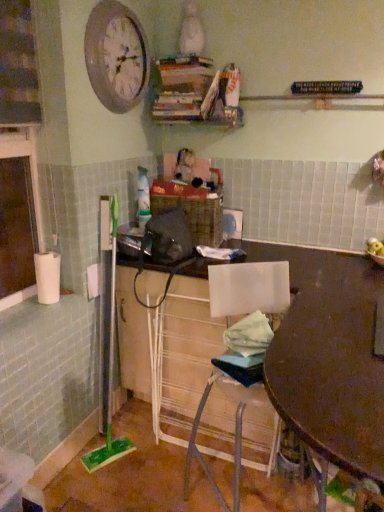
Image resolution: width=384 pixels, height=512 pixels. What do you see at coordinates (321, 267) in the screenshot?
I see `matte brown desk at center` at bounding box center [321, 267].

This screenshot has height=512, width=384. I want to click on wooden clock at upper left, so click(116, 56).

Is there a large distance between wooden clock at upper left and white plastic chair at lower center?

Indeed, wooden clock at upper left is not near white plastic chair at lower center.

Is wooden clock at upper left at the left side of white plastic chair at lower center?

Yes, wooden clock at upper left is to the left of white plastic chair at lower center.

Could you tell me if wooden clock at upper left is facing white plastic chair at lower center?

No, wooden clock at upper left is not oriented towards white plastic chair at lower center.

Looking at the image, does wooden clock at upper left seem bigger or smaller compared to white plastic chair at lower center?

In the image, wooden clock at upper left appears to be smaller than white plastic chair at lower center.

Is white plastic chair at lower center turned away from wooden clock at upper left?

That's not correct — white plastic chair at lower center is not looking away from wooden clock at upper left.

Considering the sizes of white plastic chair at lower center and wooden clock at upper left in the image, is white plastic chair at lower center taller or shorter than wooden clock at upper left?

white plastic chair at lower center is taller than wooden clock at upper left.

Is there a large distance between white plastic chair at lower center and wooden clock at upper left?

Yes, white plastic chair at lower center is far from wooden clock at upper left.

Is white plastic chair at lower center bigger than wooden clock at upper left?

Indeed, white plastic chair at lower center has a larger size compared to wooden clock at upper left.

Can you tell me how much matte brown desk at center and wooden table at center differ in facing direction?

The angle between the facing direction of matte brown desk at center and the facing direction of wooden table at center is 0.000539 degrees.

Considering the sizes of matte brown desk at center and wooden table at center in the image, is matte brown desk at center wider or thinner than wooden table at center?

Clearly, matte brown desk at center has less width compared to wooden table at center.

Measure the distance between matte brown desk at center and wooden table at center.

The distance of matte brown desk at center from wooden table at center is 15.32 inches.

Is matte brown desk at center far away from wooden table at center?

No, matte brown desk at center is not far from wooden table at center.

How much distance is there between matte brown desk at center and white plastic chair at lower center?

They are 33.31 centimeters apart.

Is matte brown desk at center far from white plastic chair at lower center?

No.

From their relative heights in the image, would you say matte brown desk at center is taller or shorter than white plastic chair at lower center?

Considering their sizes, matte brown desk at center has more height than white plastic chair at lower center.

Does matte brown desk at center have a larger size compared to white plastic chair at lower center?

Yes, matte brown desk at center is bigger than white plastic chair at lower center.

Considering the positions of point (350, 456) and point (299, 291), is point (350, 456) closer or farther from the camera than point (299, 291)?

Point (350, 456).

Identify the location of desk that appears above the wooden table at center (from the image's perspective). This screenshot has height=512, width=384. (321, 267).

Could you tell me if wooden table at center is turned towards matte brown desk at center?

No.

From the picture: From a real-world perspective, which is physically below, wooden table at center or matte brown desk at center?

matte brown desk at center is physically lower.

Where is `desk located on the right of wooden clock at upper left`? The width and height of the screenshot is (384, 512). desk located on the right of wooden clock at upper left is located at coordinates (321, 267).

Is matte brown desk at center far away from wooden clock at upper left?

Yes, matte brown desk at center and wooden clock at upper left are quite far apart.

Which object is further away from the camera, matte brown desk at center or wooden clock at upper left?

wooden clock at upper left.

Considering the points (257, 250) and (92, 57), which point is behind, point (257, 250) or point (92, 57)?

The point (257, 250) is farther from the camera.

From a real-world perspective, is wooden clock at upper left under matte brown desk at center?

No.

From the image's perspective, which one is positioned higher, wooden clock at upper left or matte brown desk at center?

wooden clock at upper left, from the image's perspective.

Which object is thinner, wooden clock at upper left or matte brown desk at center?

wooden clock at upper left is thinner.

Consider the image. Between wooden clock at upper left and matte brown desk at center, which one has larger size?

matte brown desk at center.

Where is `clock located behind the white plastic chair at lower center`? clock located behind the white plastic chair at lower center is located at coordinates (116, 56).

The height and width of the screenshot is (512, 384). Find the location of `chair that appears on the right of wooden clock at upper left`. chair that appears on the right of wooden clock at upper left is located at coordinates [249, 288].

From the image, which object appears to be nearer to matte brown desk at center, white plastic chair at lower center or wooden table at center?

Based on the image, white plastic chair at lower center appears to be nearer to matte brown desk at center.

When comparing their distances from wooden clock at upper left, does wooden table at center or white plastic chair at lower center seem further?

wooden table at center lies further to wooden clock at upper left than the other object.

Consider the image. Based on their spatial positions, is wooden clock at upper left or white plastic chair at lower center closer to matte brown desk at center?

Based on the image, white plastic chair at lower center appears to be nearer to matte brown desk at center.

Which object lies further to the anchor point wooden clock at upper left, wooden table at center or matte brown desk at center?

wooden table at center lies further to wooden clock at upper left than the other object.

When comparing their distances from wooden clock at upper left, does matte brown desk at center or white plastic chair at lower center seem further?

matte brown desk at center.

Which object lies nearer to the anchor point wooden table at center, wooden clock at upper left or white plastic chair at lower center?

white plastic chair at lower center is positioned closer to the anchor wooden table at center.

Which object lies further to the anchor point white plastic chair at lower center, wooden clock at upper left or wooden table at center?

Among the two, wooden clock at upper left is located further to white plastic chair at lower center.

Which object lies further to the anchor point white plastic chair at lower center, wooden table at center or wooden clock at upper left?

The object further to white plastic chair at lower center is wooden clock at upper left.

Where is `desk between wooden clock at upper left and wooden table at center from top to bottom`? Image resolution: width=384 pixels, height=512 pixels. desk between wooden clock at upper left and wooden table at center from top to bottom is located at coordinates (321, 267).

Locate an element on the screen. The width and height of the screenshot is (384, 512). desk located between wooden table at center and white plastic chair at lower center in the depth direction is located at coordinates (321, 267).

Where is `chair between wooden clock at upper left and wooden table at center in the up-down direction`? chair between wooden clock at upper left and wooden table at center in the up-down direction is located at coordinates (249, 288).

The height and width of the screenshot is (512, 384). I want to click on desk that lies between wooden clock at upper left and white plastic chair at lower center from top to bottom, so click(321, 267).